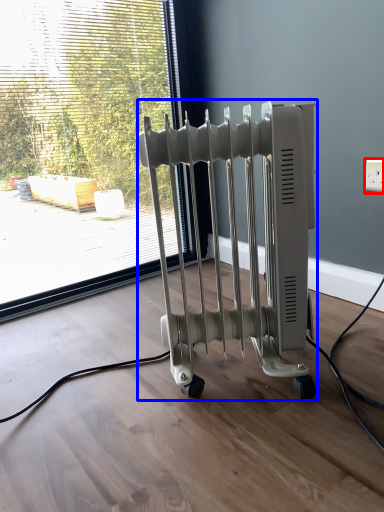
Question: Which object appears farthest to the camera in this image, electric outlet (highlighted by a red box) or bath heater (highlighted by a blue box)?

Choices:
 (A) electric outlet
 (B) bath heater

Answer: (A)